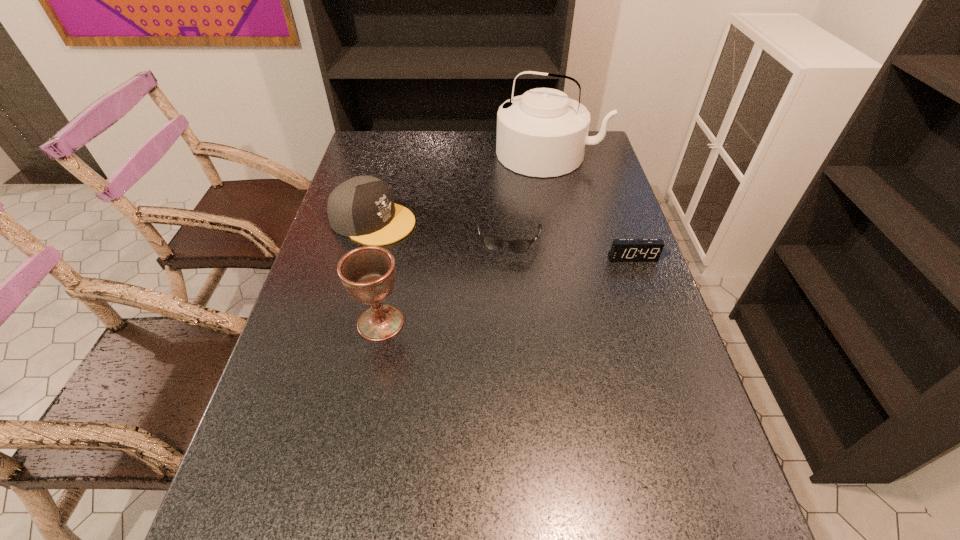
Locate an element on the screen. vacant area that lies between the kettle and the sunglasses is located at coordinates (529, 196).

The image size is (960, 540). I want to click on free space that is in between the sunglasses and the tallest object, so click(x=529, y=196).

Identify the location of unoccupied position between the tallest object and the alarm clock. The width and height of the screenshot is (960, 540). (590, 206).

Where is `free space between the farthest object and the third shortest object`? The width and height of the screenshot is (960, 540). free space between the farthest object and the third shortest object is located at coordinates click(x=461, y=187).

Locate an element on the screen. The width and height of the screenshot is (960, 540). unoccupied area between the tallest object and the nearest object is located at coordinates (465, 238).

Where is `free point between the cap and the sunglasses`? The width and height of the screenshot is (960, 540). free point between the cap and the sunglasses is located at coordinates (442, 230).

I want to click on unoccupied area between the cap and the sunglasses, so click(442, 230).

Locate an element on the screen. the third closest object relative to the alarm clock is located at coordinates (362, 208).

Identify which object is the third closest to the tallest object. Please provide its 2D coordinates. Your answer should be formatted as a tuple, i.e. [(x, y)], where the tuple contains the x and y coordinates of a point satisfying the conditions above.

[(623, 250)]